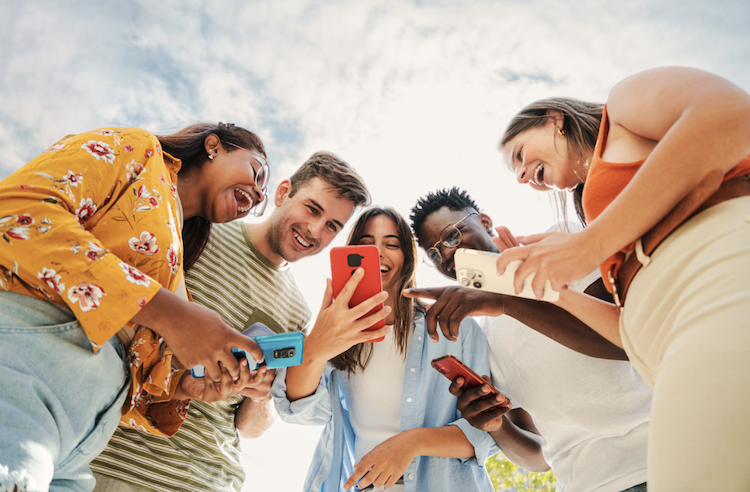
Locate an element on the screen. The height and width of the screenshot is (492, 750). phones is located at coordinates (356, 249), (276, 353), (457, 379), (483, 277).